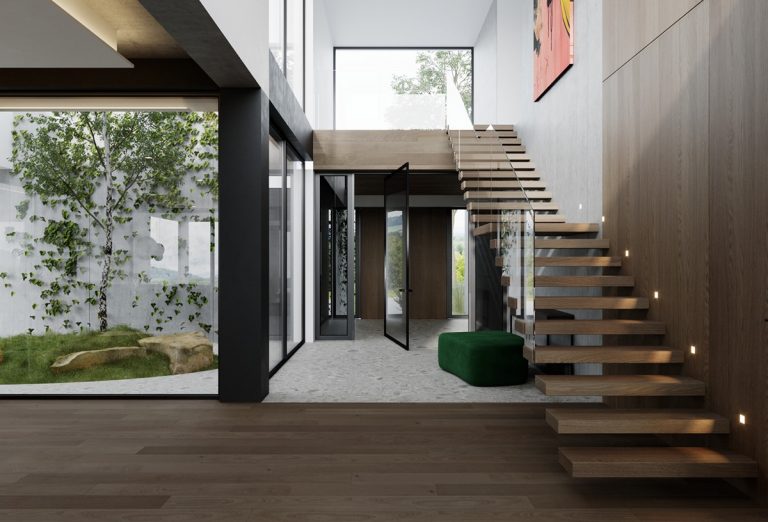
The height and width of the screenshot is (522, 768). In order to click on chaise in this screenshot , I will do `click(481, 364)`.